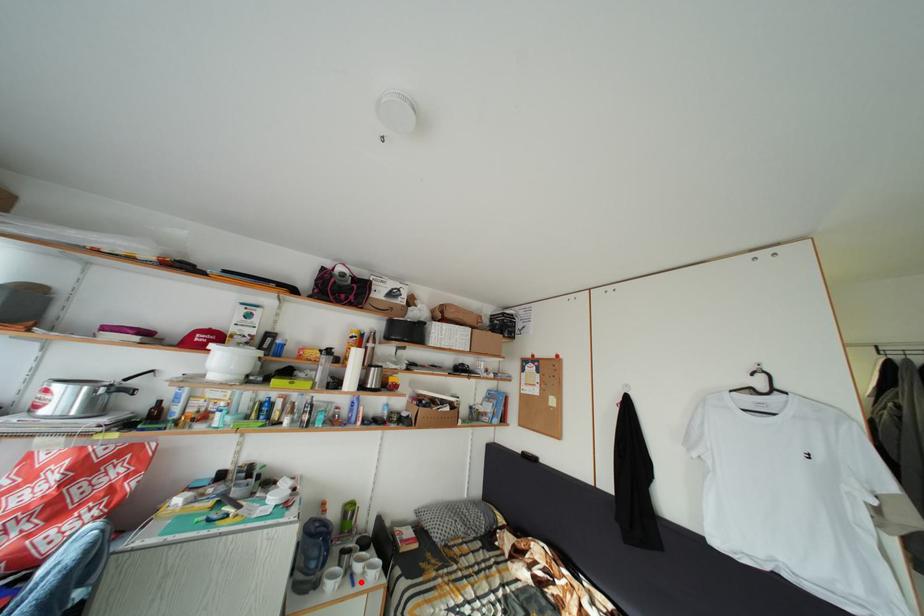
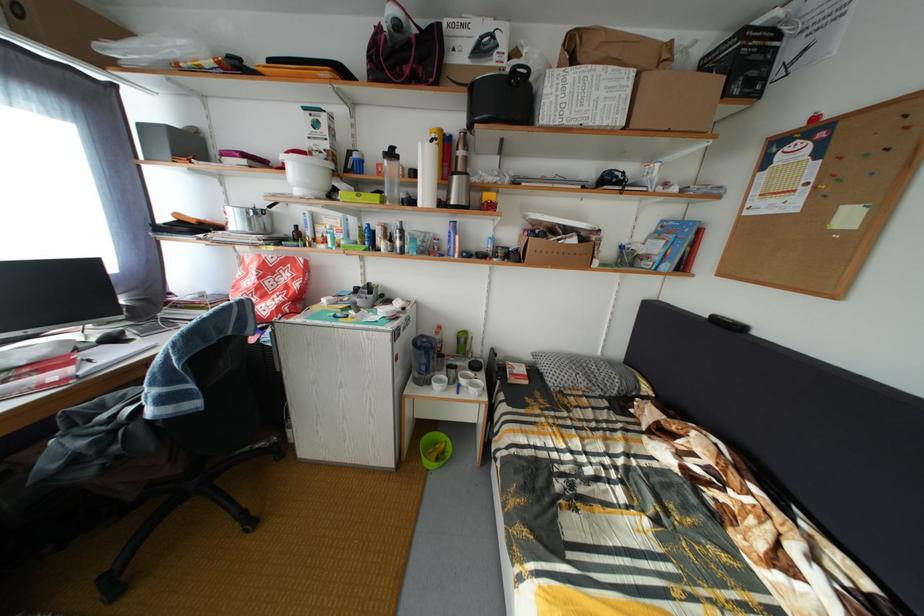
Where in the second image is the point corresponding to the highlighted location from the first image?

(468, 392)